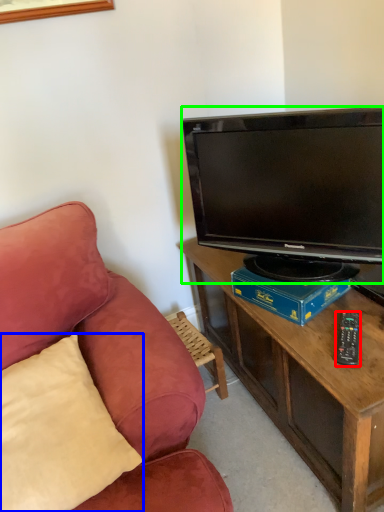
Question: Which object is positioned farthest from remote control (highlighted by a red box)? Select from pillow (highlighted by a blue box) and television (highlighted by a green box).

Choices:
 (A) pillow
 (B) television

Answer: (A)